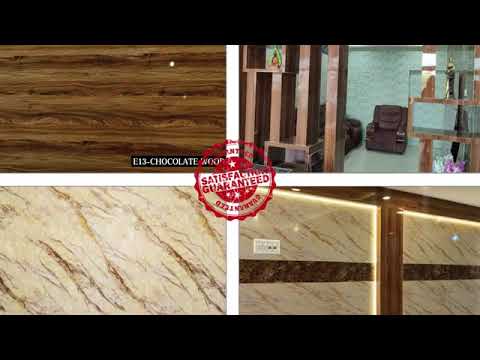
The width and height of the screenshot is (480, 360). Identify the location of area below light switch. (266, 259).